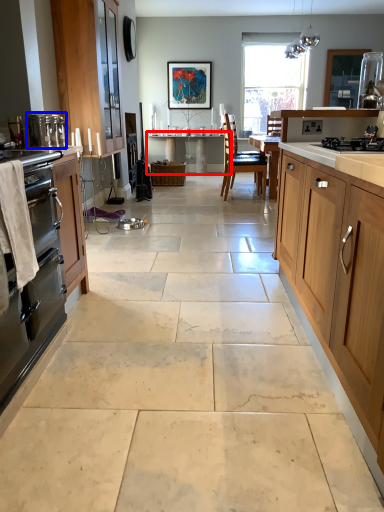
Question: Which object appears farthest to the camera in this image, table (highlighted by a red box) or appliance (highlighted by a blue box)?

Choices:
 (A) table
 (B) appliance

Answer: (A)